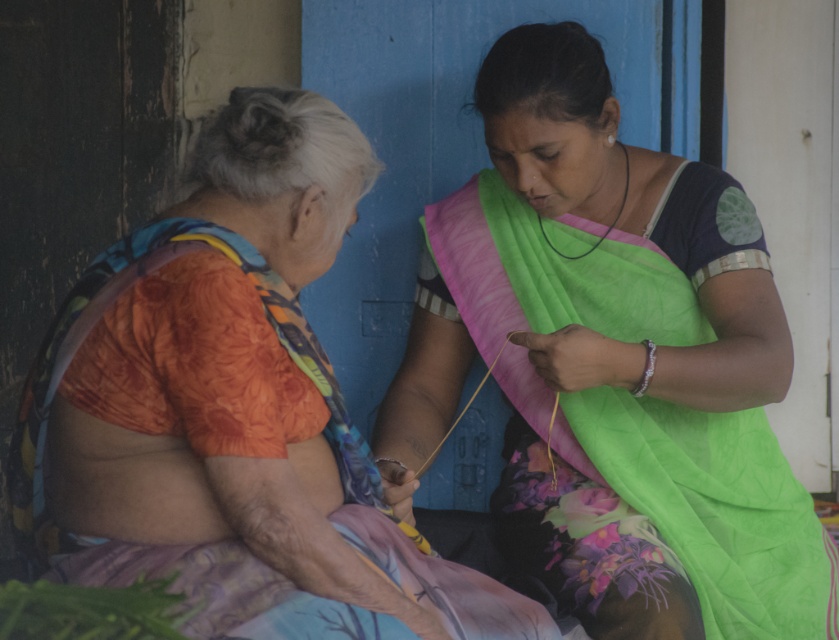
You are a fashion designer observing the scene. You notice the green silk saree at center and the orange floral blouse at left. Which clothing item is placed lower in the image?

The green silk saree at center is positioned under the orange floral blouse at left, so it is placed lower in the image.

You are a fashion designer observing the two women in the image. You need to determine which garment has a taller silhouette between the green silk saree at center and the orange floral blouse at left. Which one would you choose?

The green silk saree at center has a greater height compared to the orange floral blouse at left, so the green silk saree at center has a taller silhouette.

You are an interior designer planning to place a decorative item on a shelf that can only hold items smaller than 0.6 meters in width. You see the green silk saree at center in the image. Can you determine if the saree will fit on the shelf?

The position of green silk saree at center is at point (x=613, y=364), which indicates its width is 0.570 meters. Since this is less than 0.6 meters, the saree will fit on the shelf.